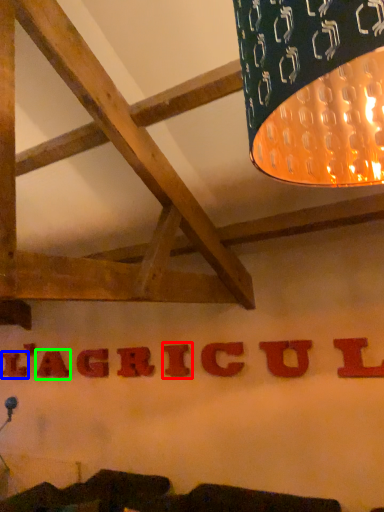
Question: Based on their relative distances, which object is farther from letter (highlighted by a red box)? Choose from letter (highlighted by a blue box) and letter (highlighted by a green box).

Choices:
 (A) letter
 (B) letter

Answer: (A)